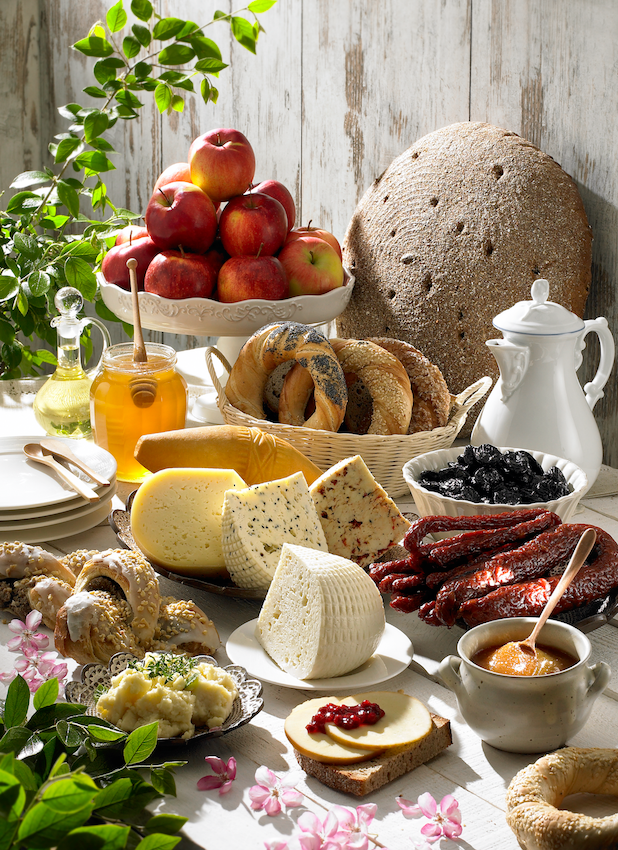
Find the location of a particular element. The height and width of the screenshot is (850, 618). serving utensil is located at coordinates [44, 461], [56, 446], [137, 341], [541, 620].